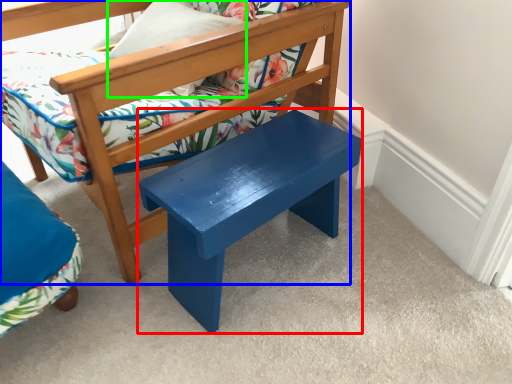
Question: Considering the real-world distances, which object is closest to stool (highlighted by a red box)? chair (highlighted by a blue box) or pillow (highlighted by a green box).

Choices:
 (A) chair
 (B) pillow

Answer: (A)